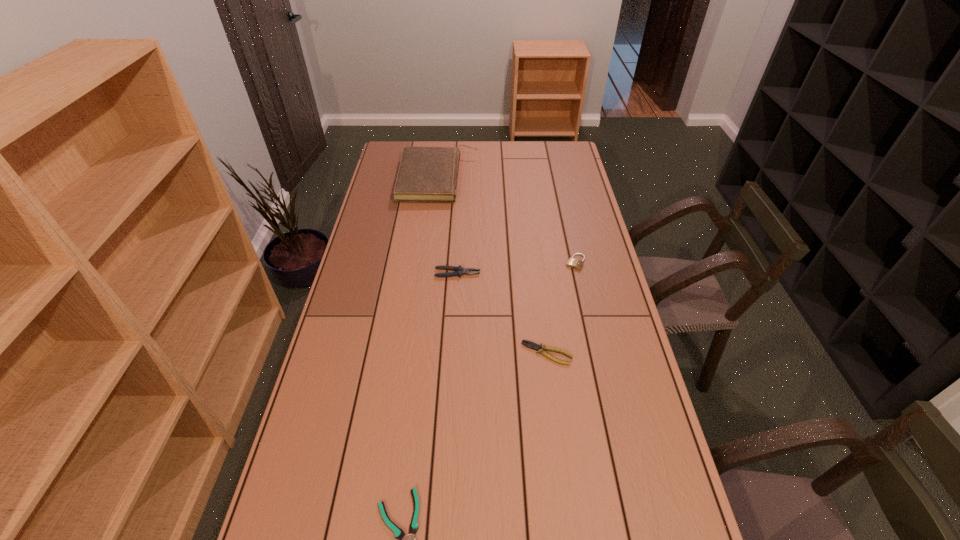
The height and width of the screenshot is (540, 960). In order to click on vacant point located between the rightmost object and the paperback book in this screenshot , I will do `click(507, 220)`.

Point out which object is positioned as the second nearest to the farthest object. Please provide its 2D coordinates. Your answer should be formatted as a tuple, i.e. [(x, y)], where the tuple contains the x and y coordinates of a point satisfying the conditions above.

[(573, 263)]

Identify the location of object that is the nearest to the fourth shortest object. The width and height of the screenshot is (960, 540). (532, 345).

You are a GUI agent. You are given a task and a screenshot of the screen. Output one action in this format:
    pyautogui.click(x=<x>, y=<y>)
    Task: Click on the second closest pliers to the farthest pliers
    This screenshot has height=540, width=960.
    Given the screenshot: What is the action you would take?
    pyautogui.click(x=409, y=539)

The width and height of the screenshot is (960, 540). I want to click on pliers that is the third nearest to the tallest object, so click(x=409, y=539).

At what (x,y) coordinates should I click in order to perform the action: click on vacant space that satisfies the following two spatial constraints: 1. on the back side of the second nearest object; 2. at the gripping part of the second tallest object. Please return your answer as a coordinate pair (x, y). Image resolution: width=960 pixels, height=540 pixels. Looking at the image, I should click on (537, 273).

The width and height of the screenshot is (960, 540). I want to click on vacant region that satisfies the following two spatial constraints: 1. on the back side of the fourth object from left to right; 2. on the right side of the rightmost object, so click(535, 262).

This screenshot has height=540, width=960. I want to click on free spot that satisfies the following two spatial constraints: 1. on the back side of the padlock; 2. on the spine side of the paperback book, so [x=557, y=178].

Locate an element on the screen. This screenshot has height=540, width=960. vacant space that satisfies the following two spatial constraints: 1. on the back side of the rightmost object; 2. on the spine side of the tallest object is located at coordinates (557, 178).

The width and height of the screenshot is (960, 540). I want to click on vacant point that satisfies the following two spatial constraints: 1. on the spine side of the paperback book; 2. on the left side of the second nearest object, so click(x=418, y=353).